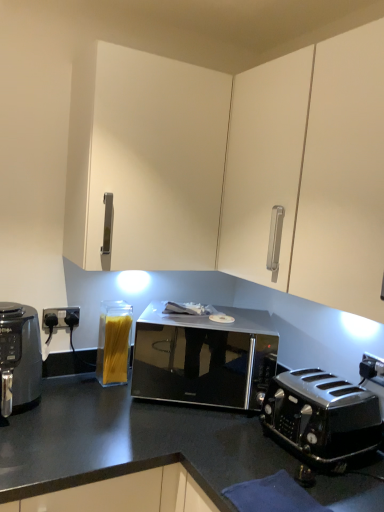
Question: Is polished black toaster at lower right further to camera compared to black matte air fryer at left?

Choices:
 (A) no
 (B) yes

Answer: (A)

Question: Considering the relative sizes of polished black toaster at lower right and black matte air fryer at left in the image provided, is polished black toaster at lower right bigger than black matte air fryer at left?

Choices:
 (A) yes
 (B) no

Answer: (A)

Question: Is polished black toaster at lower right thinner than black matte air fryer at left?

Choices:
 (A) no
 (B) yes

Answer: (A)

Question: Would you say polished black toaster at lower right is a long distance from black matte air fryer at left?

Choices:
 (A) no
 (B) yes

Answer: (A)

Question: Can you confirm if polished black toaster at lower right is positioned to the right of black matte air fryer at left?

Choices:
 (A) yes
 (B) no

Answer: (A)

Question: From the image's perspective, is polished black toaster at lower right over black matte air fryer at left?

Choices:
 (A) no
 (B) yes

Answer: (A)

Question: From the image's perspective, is polished black toaster at lower right on top of black glossy microwave at center?

Choices:
 (A) yes
 (B) no

Answer: (B)

Question: From the image's perspective, does polished black toaster at lower right appear lower than black glossy microwave at center?

Choices:
 (A) yes
 (B) no

Answer: (A)

Question: Is polished black toaster at lower right bigger than black glossy microwave at center?

Choices:
 (A) yes
 (B) no

Answer: (B)

Question: Is polished black toaster at lower right far from black glossy microwave at center?

Choices:
 (A) yes
 (B) no

Answer: (B)

Question: Could you tell me if polished black toaster at lower right is turned towards black glossy microwave at center?

Choices:
 (A) yes
 (B) no

Answer: (B)

Question: Is polished black toaster at lower right oriented away from black glossy microwave at center?

Choices:
 (A) no
 (B) yes

Answer: (A)

Question: Considering the relative positions of white matte cabinet at upper center and clear glass container of spaghetti at lower left in the image provided, is white matte cabinet at upper center to the right of clear glass container of spaghetti at lower left from the viewer's perspective?

Choices:
 (A) yes
 (B) no

Answer: (A)